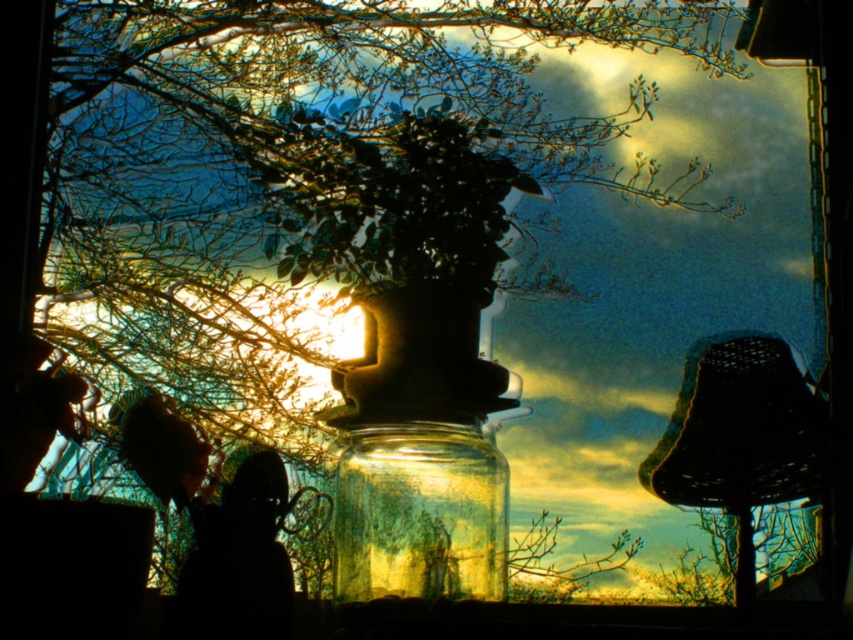
Is transparent glass jar at center shorter than black woven lampshade at right?

Correct, transparent glass jar at center is not as tall as black woven lampshade at right.

How distant is transparent glass jar at center from black woven lampshade at right?

The distance of transparent glass jar at center from black woven lampshade at right is 4.94 inches.

Who is more distant from viewer, (416, 493) or (740, 376)?

Point (740, 376)

Where is `transparent glass jar at center`? The image size is (853, 640). transparent glass jar at center is located at coordinates (421, 513).